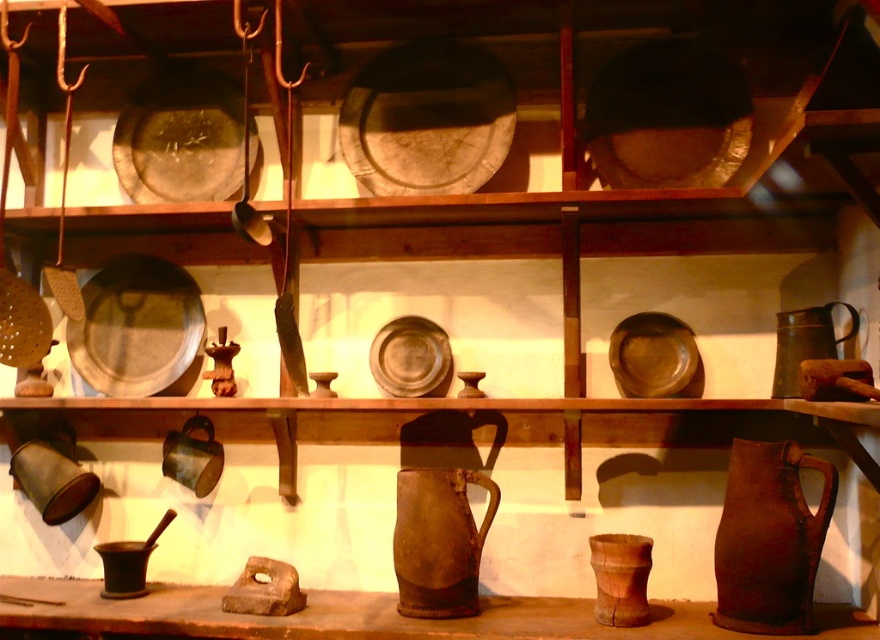
Question: Which object appears farthest from the camera in this image?

Choices:
 (A) green matte jug at right
 (B) brown wooden cup at lower center

Answer: (B)

Question: Is brown wooden cup at lower center closer to the viewer compared to green matte jug at right?

Choices:
 (A) yes
 (B) no

Answer: (B)

Question: Which of the following is the farthest from the observer?

Choices:
 (A) (610, 616)
 (B) (849, 337)

Answer: (B)

Question: Does brown wooden cup at lower center come in front of green matte jug at right?

Choices:
 (A) no
 (B) yes

Answer: (A)

Question: Can you confirm if brown wooden cup at lower center is wider than green matte jug at right?

Choices:
 (A) yes
 (B) no

Answer: (B)